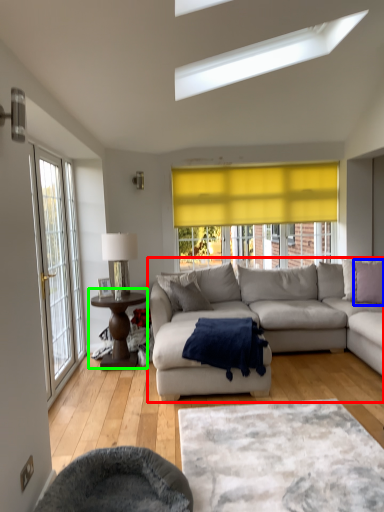
Question: Which object is positioned farthest from studio couch (highlighted by a red box)? Select from pillow (highlighted by a blue box) and coffee table (highlighted by a green box).

Choices:
 (A) pillow
 (B) coffee table

Answer: (B)